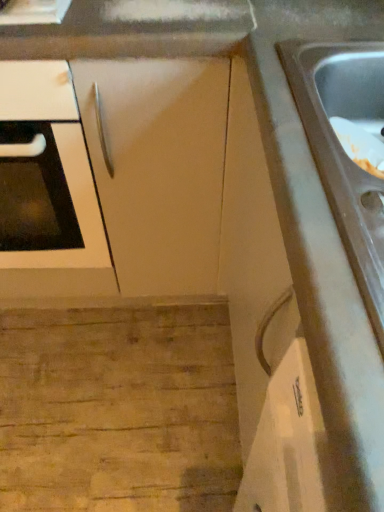
The image size is (384, 512). Describe the element at coordinates (46, 174) in the screenshot. I see `white glossy oven at left` at that location.

Find the location of a particular element. The image size is (384, 512). white glossy oven at left is located at coordinates (46, 174).

What are the coordinates of `matte white cabinet at center` in the screenshot? It's located at (158, 167).

This screenshot has height=512, width=384. What do you see at coordinates (343, 150) in the screenshot?
I see `stainless steel sink at right` at bounding box center [343, 150].

What are the coordinates of `white glossy oven at left` in the screenshot? It's located at (46, 174).

Can you confirm if stainless steel sink at right is thinner than white glossy oven at left?

Correct, the width of stainless steel sink at right is less than that of white glossy oven at left.

Is stainless steel sink at right not inside white glossy oven at left?

Yes, stainless steel sink at right is not within white glossy oven at left.

Looking at this image, can you confirm if stainless steel sink at right is shorter than white glossy oven at left?

Yes.

Where is `sink lying in front of the white glossy oven at left`? sink lying in front of the white glossy oven at left is located at coordinates (343, 150).

You are a GUI agent. You are given a task and a screenshot of the screen. Output one action in this format:
    pyautogui.click(x=<x>, y=<y>)
    Task: Click on the cabinetry that is above the stainless steel sink at right (from the image's perspective)
    The height and width of the screenshot is (512, 384).
    Given the screenshot: What is the action you would take?
    pyautogui.click(x=158, y=167)

Which is behind, matte white cabinet at center or stainless steel sink at right?

Positioned behind is matte white cabinet at center.

Which of these two, matte white cabinet at center or stainless steel sink at right, is thinner?

Thinner between the two is stainless steel sink at right.

Which is behind, point (7, 144) or point (96, 117)?

The point (7, 144) is behind.

Is white glossy oven at left in front of or behind matte white cabinet at center in the image?

In the image, white glossy oven at left appears in front of matte white cabinet at center.

In the scene shown: Who is shorter, white glossy oven at left or matte white cabinet at center?

matte white cabinet at center.

Is white glossy oven at left positioned beyond the bounds of matte white cabinet at center?

Yes, white glossy oven at left is outside of matte white cabinet at center.

Considering the sizes of objects matte white cabinet at center and white glossy oven at left in the image provided, who is shorter, matte white cabinet at center or white glossy oven at left?

matte white cabinet at center is shorter.

Would you say matte white cabinet at center is a long distance from white glossy oven at left?

No, matte white cabinet at center is in close proximity to white glossy oven at left.

Locate an element on the screen. The width and height of the screenshot is (384, 512). oven below the matte white cabinet at center (from the image's perspective) is located at coordinates (46, 174).

Would you say matte white cabinet at center contains white glossy oven at left?

No, white glossy oven at left is not inside matte white cabinet at center.

Considering the positions of objects white glossy oven at left and stainless steel sink at right in the image provided, who is more to the right, white glossy oven at left or stainless steel sink at right?

Positioned to the right is stainless steel sink at right.

From the image's perspective, is white glossy oven at left located above stainless steel sink at right?

Yes, from the image's perspective, white glossy oven at left is above stainless steel sink at right.

Does white glossy oven at left contain stainless steel sink at right?

No, white glossy oven at left does not contain stainless steel sink at right.

Is white glossy oven at left taller than stainless steel sink at right?

Correct, white glossy oven at left is much taller as stainless steel sink at right.

Is stainless steel sink at right to the right of matte white cabinet at center from the viewer's perspective?

Correct, you'll find stainless steel sink at right to the right of matte white cabinet at center.

Could matte white cabinet at center be considered to be inside stainless steel sink at right?

Definitely not — matte white cabinet at center is not inside stainless steel sink at right.

In order to click on cabinetry behind the stainless steel sink at right in this screenshot , I will do `click(158, 167)`.

This screenshot has width=384, height=512. I want to click on sink in front of the white glossy oven at left, so click(343, 150).

This screenshot has height=512, width=384. I want to click on sink below the matte white cabinet at center (from the image's perspective), so click(x=343, y=150).

Looking at the image, which one is located closer to white glossy oven at left, matte white cabinet at center or stainless steel sink at right?

Based on the image, matte white cabinet at center appears to be nearer to white glossy oven at left.

Which object lies further to the anchor point stainless steel sink at right, white glossy oven at left or matte white cabinet at center?

white glossy oven at left lies further to stainless steel sink at right than the other object.

Based on their spatial positions, is matte white cabinet at center or white glossy oven at left closer to stainless steel sink at right?

matte white cabinet at center lies closer to stainless steel sink at right than the other object.

Estimate the real-world distances between objects in this image. Which object is closer to matte white cabinet at center, stainless steel sink at right or white glossy oven at left?

The object closer to matte white cabinet at center is white glossy oven at left.

Based on their spatial positions, is stainless steel sink at right or matte white cabinet at center further from white glossy oven at left?

stainless steel sink at right lies further to white glossy oven at left than the other object.

Estimate the real-world distances between objects in this image. Which object is closer to matte white cabinet at center, white glossy oven at left or stainless steel sink at right?

Among the two, white glossy oven at left is located nearer to matte white cabinet at center.

This screenshot has width=384, height=512. Find the location of `cabinetry between white glossy oven at left and stainless steel sink at right in the horizontal direction`. cabinetry between white glossy oven at left and stainless steel sink at right in the horizontal direction is located at coordinates pyautogui.click(x=158, y=167).